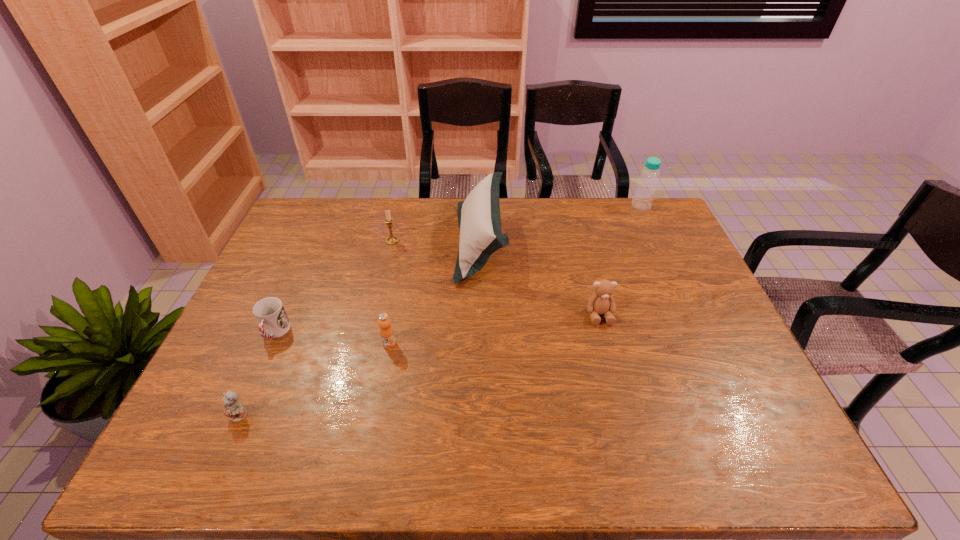
Find the location of a particular element. The image size is (960, 540). candle holder at the far edge is located at coordinates (391, 240).

Locate an element on the screen. cup that is at the left edge is located at coordinates (273, 322).

Identify the location of teddy bear situated at the left edge. Image resolution: width=960 pixels, height=540 pixels. (234, 410).

Locate an element on the screen. The width and height of the screenshot is (960, 540). object that is at the right edge is located at coordinates [x=642, y=200].

I want to click on object that is at the far right corner, so click(642, 200).

In the image, there is a desktop. Identify the location of vacant space at the far edge. This screenshot has height=540, width=960. (590, 225).

At what (x,y) coordinates should I click in order to perform the action: click on vacant space at the near edge of the desktop. Please return your answer as a coordinate pair (x, y). The height and width of the screenshot is (540, 960). Looking at the image, I should click on (622, 458).

Where is `vacant space at the left edge of the desktop`? vacant space at the left edge of the desktop is located at coordinates (199, 421).

I want to click on free space at the right edge of the desktop, so click(x=754, y=395).

This screenshot has width=960, height=540. In the image, there is a desktop. Find the location of `free space at the far left corner`. free space at the far left corner is located at coordinates (289, 238).